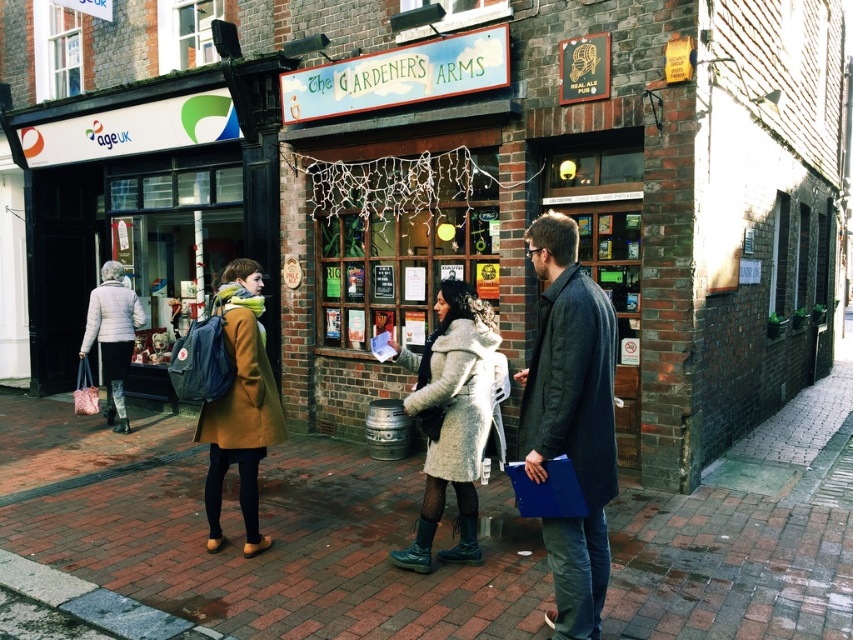
Question: Which object is closer to the camera taking this photo?

Choices:
 (A) dark gray woolen jacket at center
 (B) white quilted jacket at left
 (C) olive wool coat at center
 (D) brick pavement at center

Answer: (A)

Question: Among these objects, which one is nearest to the camera?

Choices:
 (A) dark gray woolen jacket at center
 (B) white quilted jacket at left
 (C) brick pavement at center
 (D) fluffy beige coat at center

Answer: (D)

Question: Is brick pavement at center positioned before white quilted jacket at left?

Choices:
 (A) yes
 (B) no

Answer: (A)

Question: Which object appears farthest from the camera in this image?

Choices:
 (A) olive wool coat at center
 (B) fluffy beige coat at center
 (C) fuzzy white coat at center

Answer: (A)

Question: In this image, where is dark gray woolen jacket at center located relative to fuzzy white coat at center?

Choices:
 (A) below
 (B) above

Answer: (B)

Question: Is fuzzy white coat at center to the left of white quilted jacket at left from the viewer's perspective?

Choices:
 (A) no
 (B) yes

Answer: (A)